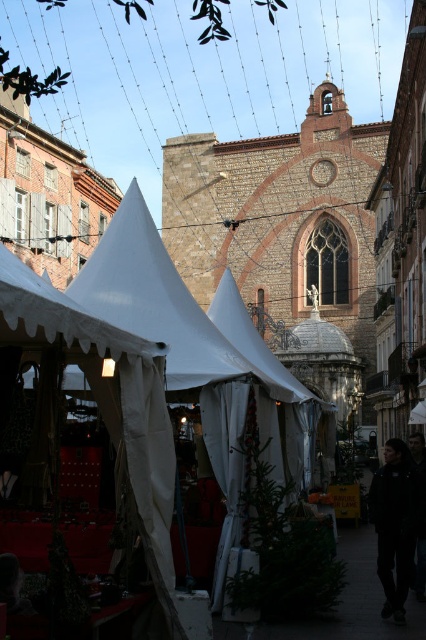
You are a delivery person who needs to place a package that is 2 meters long between the white fabric tent at left and the black fabric at lower right. Is there enough space between them to place the package without moving either object?

The white fabric tent at left is 18.33 meters from the black fabric at lower right, so yes, there is enough space to place the 2 meter long package between them without moving either object.

You are standing at the entrance of the market and want to find the white canvas tent at left. According to the coordinates provided in the Objects Description, in which direction should you move to reach it?

The white canvas tent at left is located at coordinates point (109, 404). Since the x coordinate is 0.633, which is to the right of the center, you should move to the right to reach it.

You are setting up a market stall and need to choose between the white canvas tent at left and the white fabric tent at left. Which one is narrower in width?

The white canvas tent at left is thinner than the white fabric tent at left, so it is narrower in width.